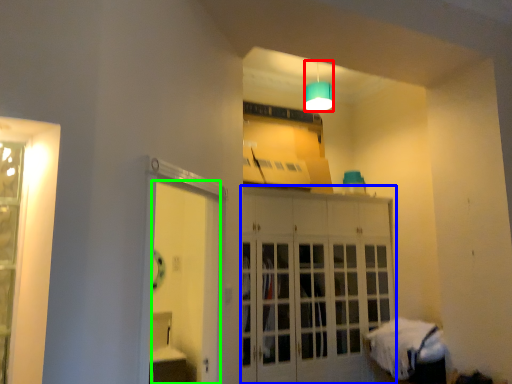
Question: Which is farther away from lamp (highlighted by a red box)? cabinetry (highlighted by a blue box) or door (highlighted by a green box)?

Choices:
 (A) cabinetry
 (B) door

Answer: (B)